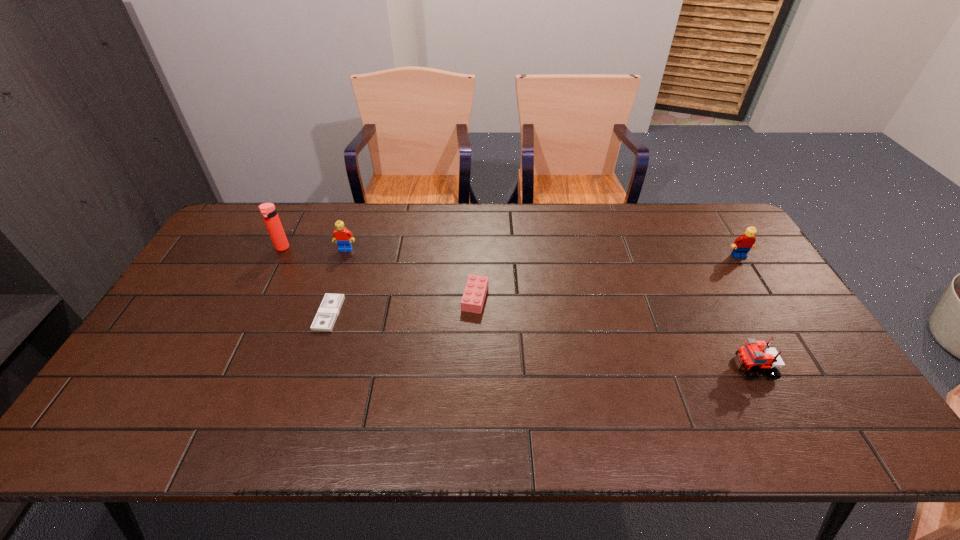
Locate an element on the screen. free point between the third nearest Lego and the fourth object from left to right is located at coordinates (607, 277).

What are the coordinates of `free space between the leftmost Lego and the tallest object` in the screenshot? It's located at (314, 248).

Identify the location of free space between the second farthest Lego and the leftmost object. The height and width of the screenshot is (540, 960). 511,252.

In order to click on free area in between the farthest Lego and the dollar in this screenshot , I will do `click(338, 281)`.

At what (x,y) coordinates should I click in order to perform the action: click on unoccupied area between the farthest Lego and the third object from right to left. Please return your answer as a coordinate pair (x, y). This screenshot has height=540, width=960. Looking at the image, I should click on (411, 273).

Find the location of a particular element. Image resolution: width=960 pixels, height=540 pixels. free spot between the leftmost object and the third Lego from left to right is located at coordinates (517, 308).

Identify which object is the fourth nearest to the dollar. Please provide its 2D coordinates. Your answer should be formatted as a tuple, i.e. [(x, y)], where the tuple contains the x and y coordinates of a point satisfying the conditions above.

[(755, 355)]

In order to click on object that ranks as the third closest to the rightmost Lego in this screenshot , I will do (x=343, y=237).

Identify which Lego is the nearest to the third nearest Lego. Please provide its 2D coordinates. Your answer should be formatted as a tuple, i.e. [(x, y)], where the tuple contains the x and y coordinates of a point satisfying the conditions above.

[(755, 355)]

Select which Lego is the fourth closest to the tallest object. Please provide its 2D coordinates. Your answer should be formatted as a tuple, i.e. [(x, y)], where the tuple contains the x and y coordinates of a point satisfying the conditions above.

[(742, 245)]